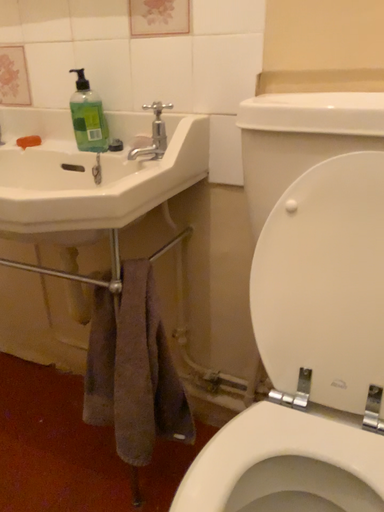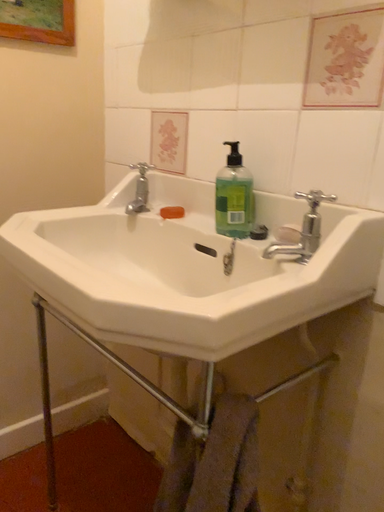
Question: How did the camera likely rotate when shooting the video?

Choices:
 (A) rotated left
 (B) rotated right

Answer: (A)